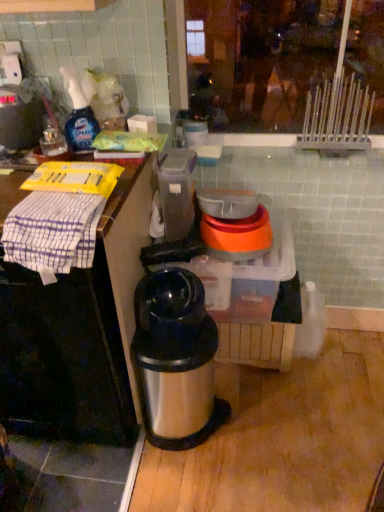
You are a GUI agent. You are given a task and a screenshot of the screen. Output one action in this format:
    pyautogui.click(x=<x>, y=<y>)
    Task: Click on the vacant space to the right of stainless steel thermos at center
    This screenshot has width=384, height=512.
    Given the screenshot: What is the action you would take?
    pyautogui.click(x=264, y=419)